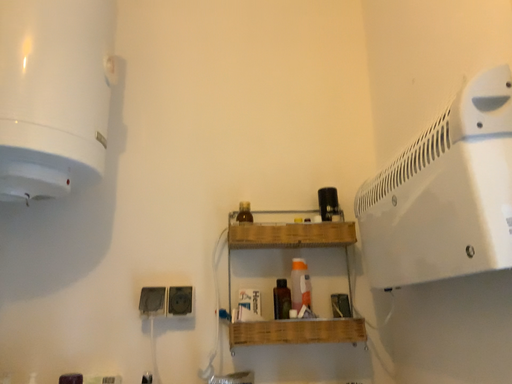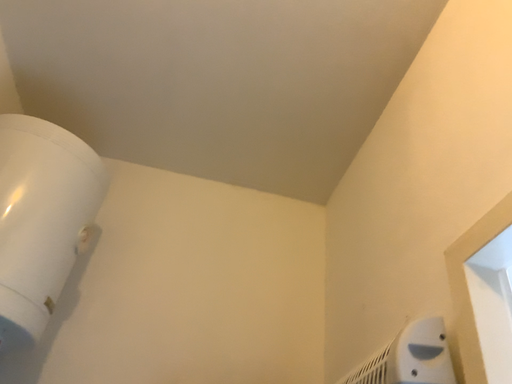
Question: How did the camera likely rotate when shooting the video?

Choices:
 (A) rotated left
 (B) rotated right

Answer: (B)